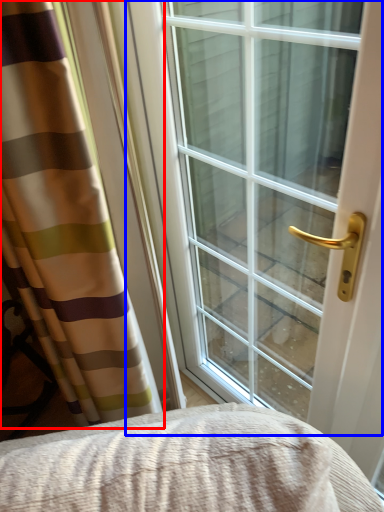
Question: Which point is closer to the camera, curtain (highlighted by a red box) or window (highlighted by a blue box)?

Choices:
 (A) curtain
 (B) window

Answer: (A)